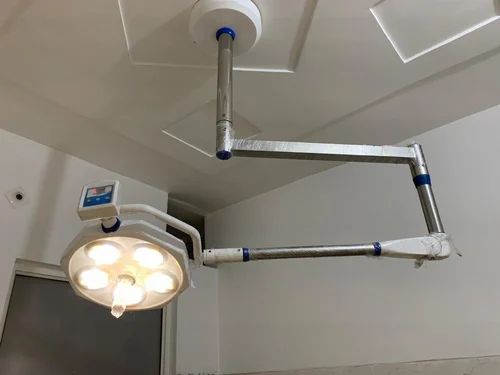
This screenshot has width=500, height=375. What are the coordinates of `door frame` in the screenshot? It's located at [30, 269].